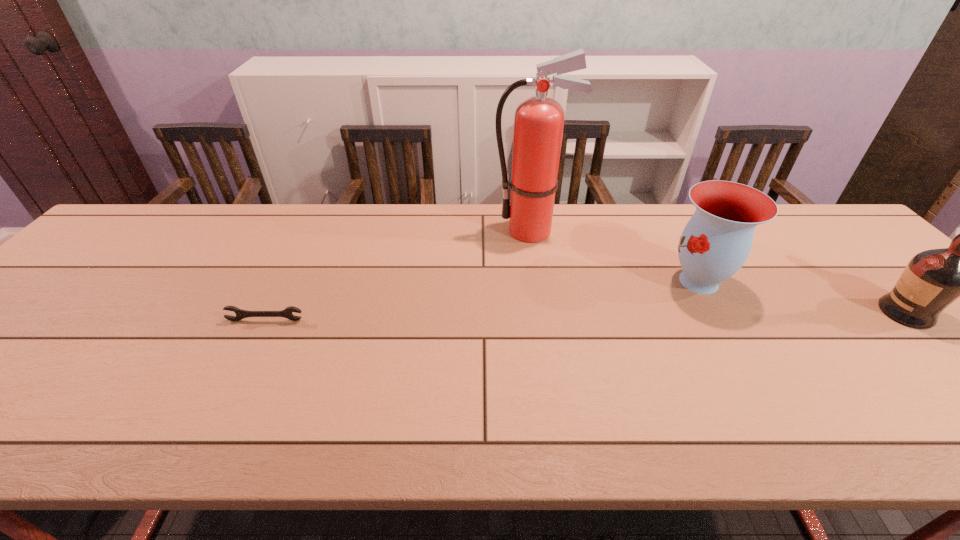
I want to click on vacant area between the rightmost object and the vase, so click(803, 297).

Identify which object is the third nearest to the second object from right to left. Please provide its 2D coordinates. Your answer should be formatted as a tuple, i.e. [(x, y)], where the tuple contains the x and y coordinates of a point satisfying the conditions above.

[(287, 312)]

You are a GUI agent. You are given a task and a screenshot of the screen. Output one action in this format:
    pyautogui.click(x=<x>, y=<y>)
    Task: Click on the third closest object to the liquor
    This screenshot has height=540, width=960.
    Given the screenshot: What is the action you would take?
    pyautogui.click(x=287, y=312)

Locate an element on the screen. This screenshot has width=960, height=540. vacant space that satisfies the following two spatial constraints: 1. on the hose direction of the tallest object; 2. on the open ends of the leftmost object is located at coordinates (545, 320).

Identify the location of free region that satisfies the following two spatial constraints: 1. on the hose direction of the farthest object; 2. on the open ends of the shortest object. (545, 320).

Image resolution: width=960 pixels, height=540 pixels. I want to click on free space that satisfies the following two spatial constraints: 1. on the back side of the vase; 2. on the hose direction of the fire extinguisher, so click(x=670, y=231).

The width and height of the screenshot is (960, 540). What are the coordinates of `vacant space that satisfies the following two spatial constraints: 1. on the hose direction of the second object from left to right; 2. on the open ends of the shortest object` in the screenshot? It's located at (545, 320).

Image resolution: width=960 pixels, height=540 pixels. In order to click on blank space that satisfies the following two spatial constraints: 1. on the back side of the vase; 2. on the hose direction of the tallest object in this screenshot , I will do `click(670, 231)`.